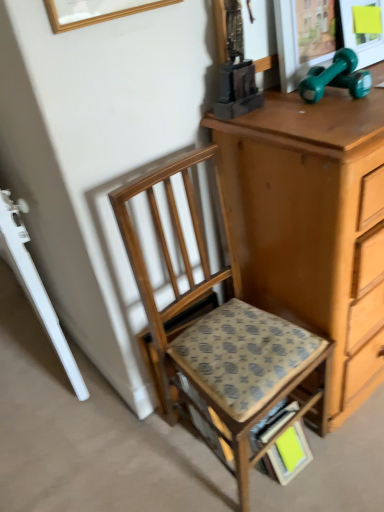
Question: From the image's perspective, is wooden picture frame at upper center located above or below wooden chair at center?

Choices:
 (A) below
 (B) above

Answer: (B)

Question: Is wooden picture frame at upper center wider or thinner than wooden chair at center?

Choices:
 (A) thin
 (B) wide

Answer: (A)

Question: Based on their relative distances, which object is farther from the wooden picture frame at upper center?

Choices:
 (A) patterned fabric step stool at center
 (B) wooden chair at center

Answer: (A)

Question: Which object is the closest to the wooden chair at center?

Choices:
 (A) wooden picture frame at upper center
 (B) patterned fabric step stool at center

Answer: (B)